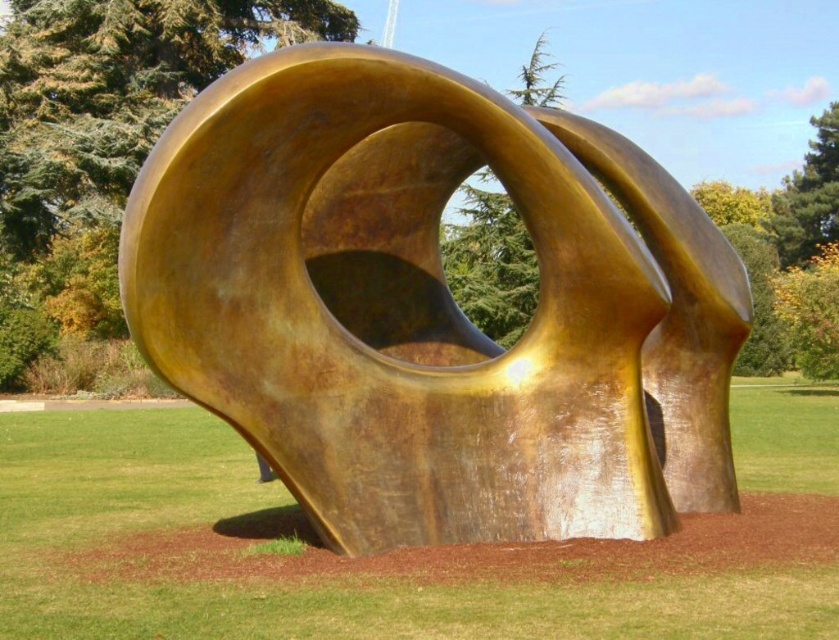
Does gold polished sculpture at center appear on the left side of green grass at center?

Correct, you'll find gold polished sculpture at center to the left of green grass at center.

Can you confirm if gold polished sculpture at center is positioned to the right of green grass at center?

No, gold polished sculpture at center is not to the right of green grass at center.

Which is in front, point (181, 113) or point (567, 561)?

Positioned in front is point (567, 561).

You are a GUI agent. You are given a task and a screenshot of the screen. Output one action in this format:
    pyautogui.click(x=<x>, y=<y>)
    Task: Click on the gold polished sculpture at center
    This screenshot has width=839, height=640.
    Given the screenshot: What is the action you would take?
    pyautogui.click(x=433, y=307)